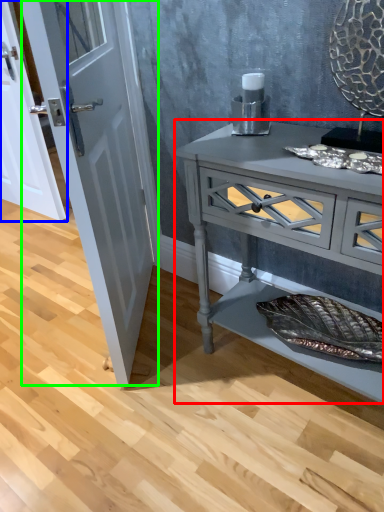
Question: Which object is the closest to the chest of drawers (highlighted by a red box)? Choose among these: door (highlighted by a blue box) or door (highlighted by a green box).

Choices:
 (A) door
 (B) door

Answer: (B)